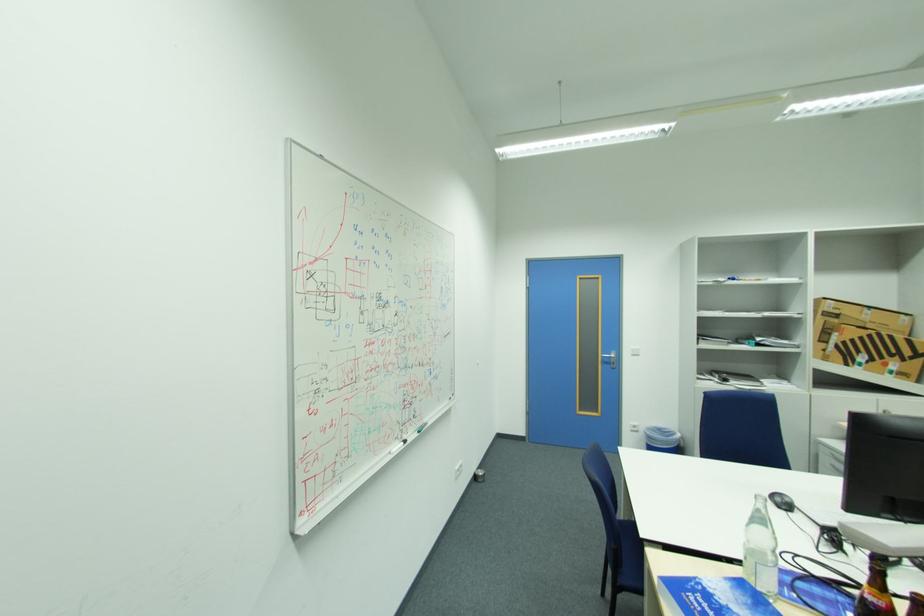
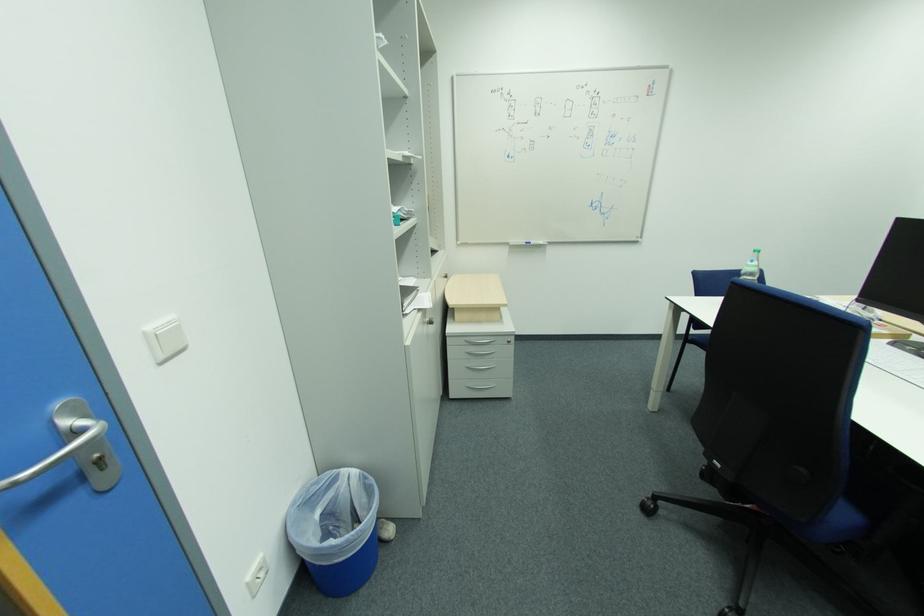
Where in the second image is the point corresponding to point 618,369 from the first image?

(111, 488)